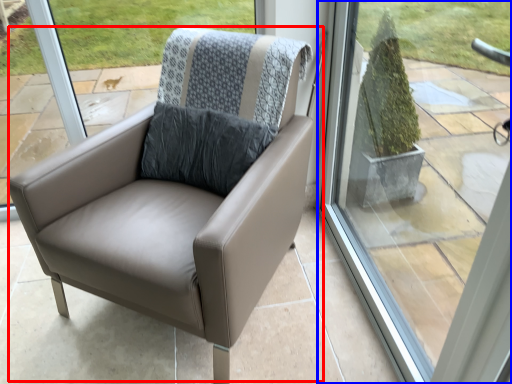
Question: Which object is closer to the camera taking this photo, chair (highlighted by a red box) or window (highlighted by a blue box)?

Choices:
 (A) chair
 (B) window

Answer: (B)